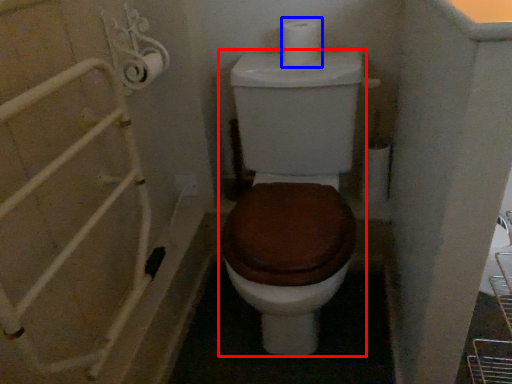
Question: Which object is closer to the camera taking this photo, toilet (highlighted by a red box) or toilet paper (highlighted by a blue box)?

Choices:
 (A) toilet
 (B) toilet paper

Answer: (A)